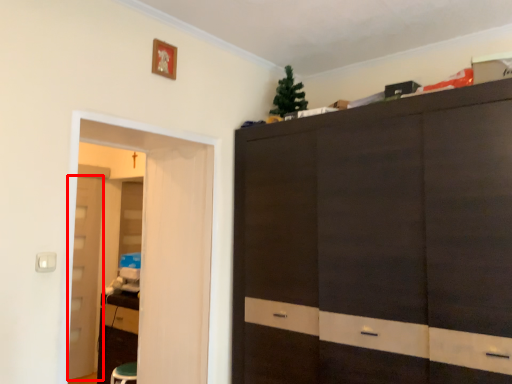
Question: From the image, what is the correct spatial relationship of door (annotated by the red box) in relation to screen door?

Choices:
 (A) left
 (B) right

Answer: (A)